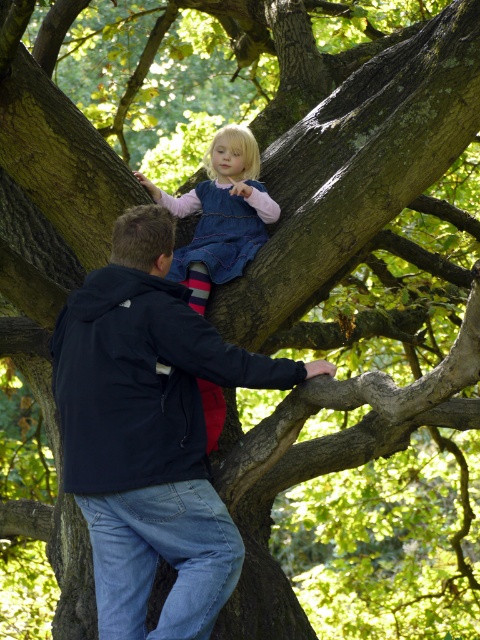
Question: Can you confirm if dark blue jacket at upper center is bigger than denim dress at upper center?

Choices:
 (A) no
 (B) yes

Answer: (B)

Question: Can you confirm if dark blue jacket at upper center is positioned above denim dress at upper center?

Choices:
 (A) yes
 (B) no

Answer: (B)

Question: Which point is farther to the camera?

Choices:
 (A) dark blue jacket at upper center
 (B) denim dress at upper center

Answer: (B)

Question: Does dark blue jacket at upper center appear under denim dress at upper center?

Choices:
 (A) yes
 (B) no

Answer: (A)

Question: Among these objects, which one is nearest to the camera?

Choices:
 (A) denim dress at upper center
 (B) dark blue jacket at upper center

Answer: (B)